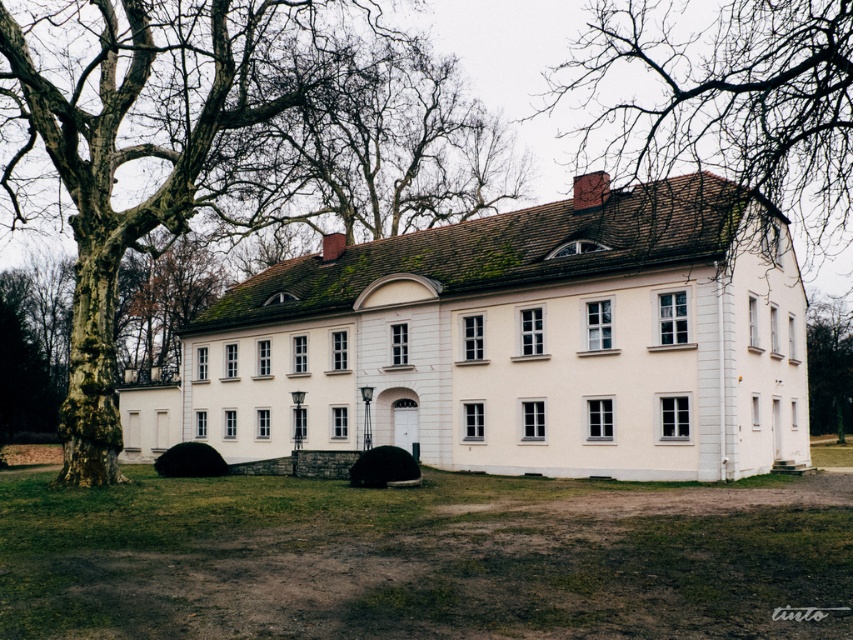
Question: Which point appears farthest from the camera in this image?

Choices:
 (A) (154, 177)
 (B) (793, 64)

Answer: (A)

Question: Is smooth bark tree at left positioned behind green leafy tree at right?

Choices:
 (A) no
 (B) yes

Answer: (A)

Question: Which of the following is the closest to the observer?

Choices:
 (A) smooth bark tree at left
 (B) bare branches at upper center

Answer: (B)

Question: Does smooth bark tree at left have a greater width compared to bare branches at upper center?

Choices:
 (A) no
 (B) yes

Answer: (B)

Question: Based on their relative distances, which object is nearer to the green leafy tree at right?

Choices:
 (A) bare branches at upper center
 (B) smooth bark tree at left

Answer: (A)

Question: Does smooth bark tree at left appear on the left side of bare branches at upper center?

Choices:
 (A) yes
 (B) no

Answer: (A)